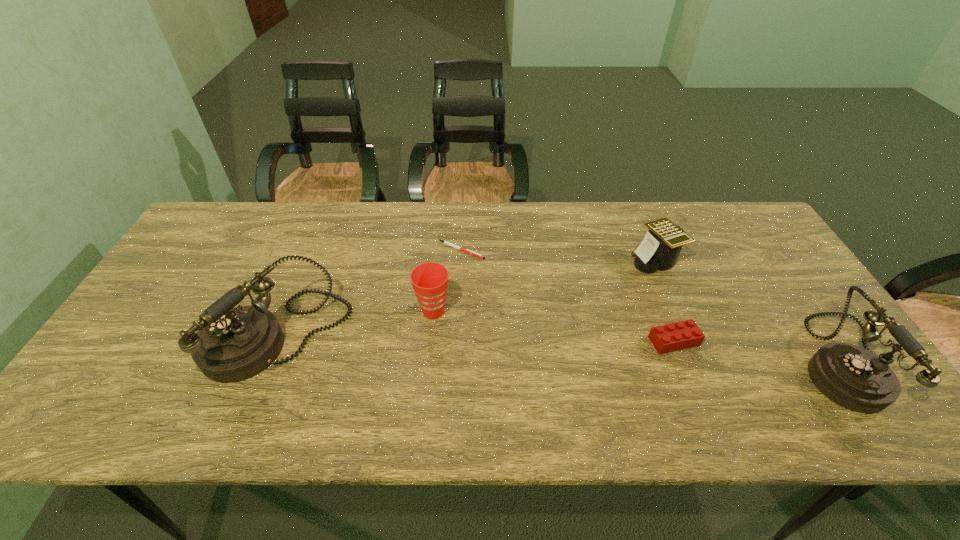
At what (x,y) coordinates should I click in order to perform the action: click on free space between the third shortest object and the Lego. Please return your answer as a coordinate pair (x, y). Looking at the image, I should click on (664, 301).

Where is `vacant area that lies between the taller telephone and the pen`? vacant area that lies between the taller telephone and the pen is located at coordinates (x=370, y=294).

Locate which object is the third closest to the Lego. Please provide its 2D coordinates. Your answer should be formatted as a tuple, i.e. [(x, y)], where the tuple contains the x and y coordinates of a point satisfying the conditions above.

[(445, 242)]

Locate an element on the screen. This screenshot has width=960, height=540. object that ranks as the fourth closest to the fifth tallest object is located at coordinates (429, 280).

Where is `free region that satisfies the following two spatial constraints: 1. on the front side of the second shortest object; 2. on the right side of the tallest object`? The image size is (960, 540). free region that satisfies the following two spatial constraints: 1. on the front side of the second shortest object; 2. on the right side of the tallest object is located at coordinates pos(276,341).

This screenshot has width=960, height=540. I want to click on blank area in the image that satisfies the following two spatial constraints: 1. on the clicker of the shortest object; 2. on the left side of the Lego, so click(x=457, y=341).

Locate an element on the screen. vacant position in the image that satisfies the following two spatial constraints: 1. on the clicker of the fourth tallest object; 2. on the left side of the pen is located at coordinates [461, 260].

Locate an element on the screen. The width and height of the screenshot is (960, 540). free location that satisfies the following two spatial constraints: 1. on the back side of the Lego; 2. on the clicker of the shortest object is located at coordinates (638, 250).